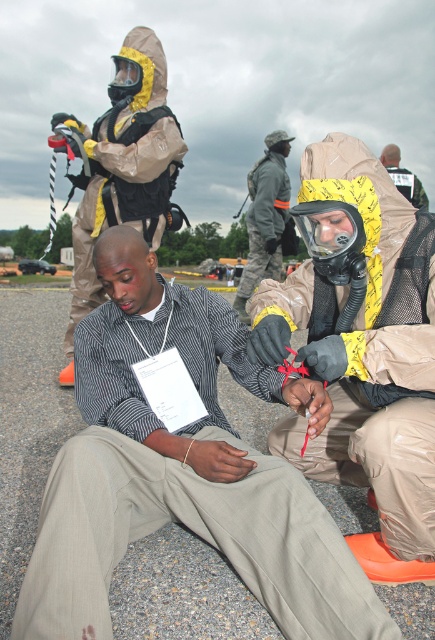
Does striped shirt at center have a greater width compared to camouflage fabric uniform at center?

Correct, the width of striped shirt at center exceeds that of camouflage fabric uniform at center.

Which is above, striped shirt at center or camouflage fabric uniform at center?

camouflage fabric uniform at center is above.

This screenshot has width=435, height=640. What do you see at coordinates (183, 472) in the screenshot?
I see `striped shirt at center` at bounding box center [183, 472].

Find the location of a particular element. striped shirt at center is located at coordinates (183, 472).

Can you confirm if matte black gas mask at upper center is taller than camouflage fabric uniform at center?

Yes.

Does matte black gas mask at upper center have a lesser width compared to camouflage fabric uniform at center?

No, matte black gas mask at upper center is not thinner than camouflage fabric uniform at center.

Between point (70, 349) and point (275, 172), which one is positioned behind?

The point (275, 172) is more distant.

Identify the location of matte black gas mask at upper center. The width and height of the screenshot is (435, 640). (124, 164).

Between point (200, 512) and point (100, 132), which one is positioned in front?

Point (200, 512) is in front.

How distant is striped shirt at center from matte black gas mask at upper center?

striped shirt at center is 5.58 feet away from matte black gas mask at upper center.

Who is more forward, [331,628] or [73,291]?

Point [331,628]

Image resolution: width=435 pixels, height=640 pixels. Find the location of `striped shirt at center`. striped shirt at center is located at coordinates (183, 472).